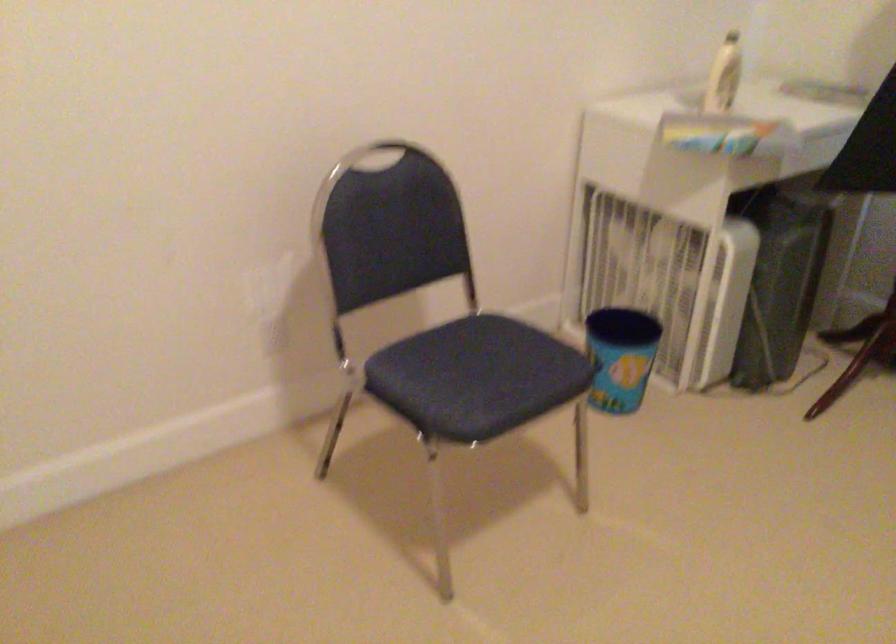
At what (x,y) coordinates should I click in order to perform the action: click on chair sitting surface. Please return your answer as a coordinate pair (x, y). This screenshot has width=896, height=644. Looking at the image, I should click on (476, 377).